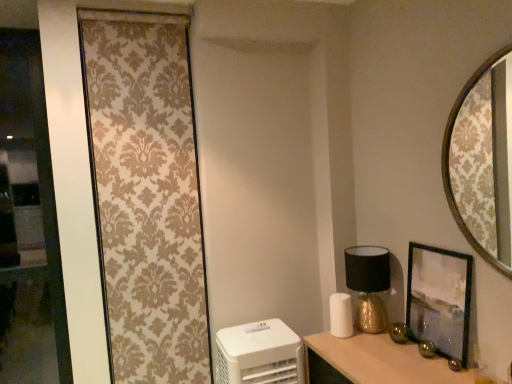
Question: Does white plastic air purifier at lower left lie behind beige damask curtain at left?

Choices:
 (A) yes
 (B) no

Answer: (B)

Question: Can you confirm if white plastic air purifier at lower left is wider than beige damask curtain at left?

Choices:
 (A) no
 (B) yes

Answer: (B)

Question: Is beige damask curtain at left surrounded by white plastic air purifier at lower left?

Choices:
 (A) no
 (B) yes

Answer: (A)

Question: Does white plastic air purifier at lower left turn towards beige damask curtain at left?

Choices:
 (A) no
 (B) yes

Answer: (A)

Question: Can you confirm if white plastic air purifier at lower left is thinner than beige damask curtain at left?

Choices:
 (A) yes
 (B) no

Answer: (B)

Question: Is wooden frame mirror at upper right taller or shorter than beige damask curtain at left?

Choices:
 (A) short
 (B) tall

Answer: (A)

Question: Would you say wooden frame mirror at upper right is to the left or to the right of beige damask curtain at left in the picture?

Choices:
 (A) left
 (B) right

Answer: (B)

Question: From a real-world perspective, is wooden frame mirror at upper right physically located above or below beige damask curtain at left?

Choices:
 (A) above
 (B) below

Answer: (A)

Question: Choose the correct answer: Is wooden frame mirror at upper right inside beige damask curtain at left or outside it?

Choices:
 (A) inside
 (B) outside

Answer: (B)

Question: Is transparent glass door at left taller or shorter than wooden frame mirror at upper right?

Choices:
 (A) tall
 (B) short

Answer: (A)

Question: Considering their positions, is transparent glass door at left located in front of or behind wooden frame mirror at upper right?

Choices:
 (A) behind
 (B) front

Answer: (A)

Question: In terms of size, does transparent glass door at left appear bigger or smaller than wooden frame mirror at upper right?

Choices:
 (A) big
 (B) small

Answer: (A)

Question: Based on their positions, is transparent glass door at left located to the left or right of wooden frame mirror at upper right?

Choices:
 (A) left
 (B) right

Answer: (A)

Question: Is matte black picture frame at right inside the boundaries of white plastic air purifier at lower left, or outside?

Choices:
 (A) outside
 (B) inside

Answer: (A)

Question: Considering the positions of matte black picture frame at right and white plastic air purifier at lower left in the image, is matte black picture frame at right wider or thinner than white plastic air purifier at lower left?

Choices:
 (A) thin
 (B) wide

Answer: (A)